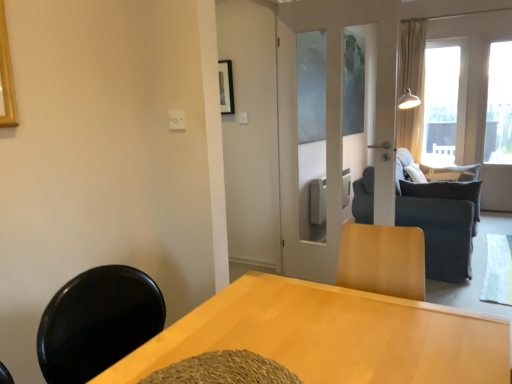
Question: Can beige fabric curtain at right be found inside light wood table at center?

Choices:
 (A) no
 (B) yes

Answer: (A)

Question: Is light wood table at center far from beige fabric curtain at right?

Choices:
 (A) no
 (B) yes

Answer: (B)

Question: Does light wood table at center have a lesser height compared to beige fabric curtain at right?

Choices:
 (A) yes
 (B) no

Answer: (A)

Question: Does light wood table at center have a lesser width compared to beige fabric curtain at right?

Choices:
 (A) yes
 (B) no

Answer: (B)

Question: Is light wood table at center to the right of beige fabric curtain at right from the viewer's perspective?

Choices:
 (A) no
 (B) yes

Answer: (A)

Question: Which is correct: dark gray fabric pillow at right is inside dark gray fabric couch at center, or outside of it?

Choices:
 (A) inside
 (B) outside

Answer: (A)

Question: Considering the positions of dark gray fabric pillow at right and dark gray fabric couch at center in the image, is dark gray fabric pillow at right taller or shorter than dark gray fabric couch at center?

Choices:
 (A) short
 (B) tall

Answer: (A)

Question: In the image, is dark gray fabric pillow at right on the left side or the right side of dark gray fabric couch at center?

Choices:
 (A) left
 (B) right

Answer: (A)

Question: From the image's perspective, is dark gray fabric pillow at right above or below dark gray fabric couch at center?

Choices:
 (A) above
 (B) below

Answer: (A)

Question: Is point (430, 193) closer or farther from the camera than point (411, 379)?

Choices:
 (A) farther
 (B) closer

Answer: (A)

Question: Is dark gray fabric pillow at right inside or outside of light wood table at center?

Choices:
 (A) outside
 (B) inside

Answer: (A)

Question: From a real-world perspective, is dark gray fabric pillow at right positioned above or below light wood table at center?

Choices:
 (A) below
 (B) above

Answer: (A)

Question: In the image, is dark gray fabric pillow at right positioned in front of or behind light wood table at center?

Choices:
 (A) behind
 (B) front

Answer: (A)

Question: Considering the positions of light wood table at center and beige fabric curtain at right in the image, is light wood table at center taller or shorter than beige fabric curtain at right?

Choices:
 (A) tall
 (B) short

Answer: (B)

Question: Is point (507, 322) closer or farther from the camera than point (413, 122)?

Choices:
 (A) farther
 (B) closer

Answer: (B)